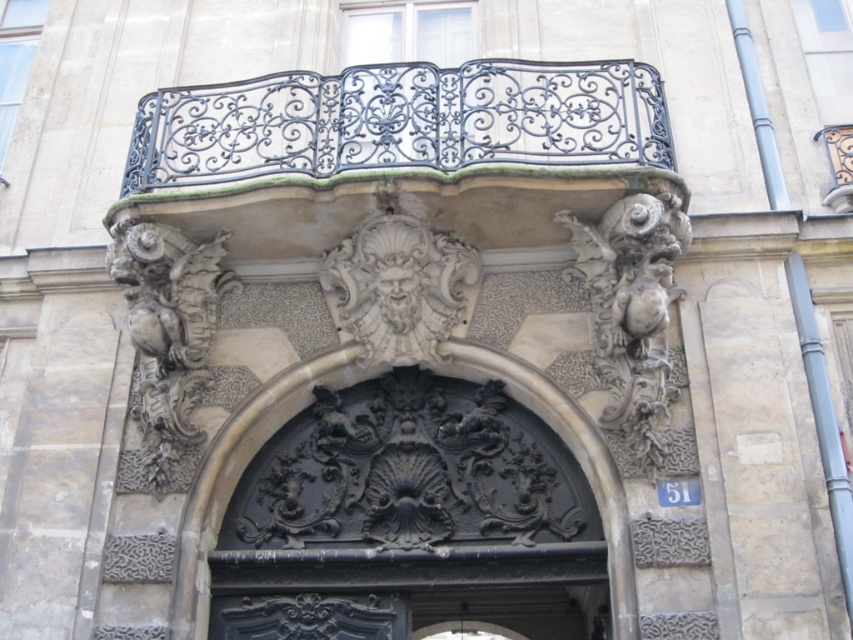
Question: Is polished stone cherub at center wider than dark gray stone lion at center?

Choices:
 (A) yes
 (B) no

Answer: (A)

Question: Among these objects, which one is nearest to the camera?

Choices:
 (A) polished stone cherub at center
 (B) white stone sculpture at center
 (C) dark gray stone lion at center
 (D) black wrought iron balcony at upper center

Answer: (A)

Question: Does black wrought iron door at center have a lesser width compared to polished stone cherub at center?

Choices:
 (A) no
 (B) yes

Answer: (A)

Question: Among these points, which one is farthest from the camera?

Choices:
 (A) (614, 307)
 (B) (285, 99)
 (C) (201, 273)

Answer: (C)

Question: Does black wrought iron door at center appear under polished stone cherub at center?

Choices:
 (A) no
 (B) yes

Answer: (B)

Question: Among these points, which one is nearest to the camera?

Choices:
 (A) (387, 259)
 (B) (131, 314)
 (C) (595, 352)
 (D) (360, 154)

Answer: (D)